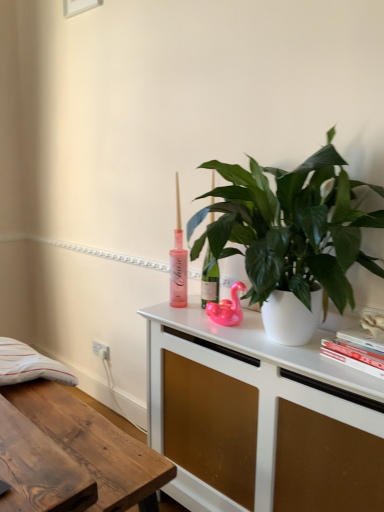
Question: Is wooden desk at lower left with pink rubber duck at center?

Choices:
 (A) yes
 (B) no

Answer: (B)

Question: Is wooden desk at lower left in front of pink rubber duck at center?

Choices:
 (A) yes
 (B) no

Answer: (A)

Question: Is wooden desk at lower left surrounding pink rubber duck at center?

Choices:
 (A) no
 (B) yes

Answer: (A)

Question: Is wooden desk at lower left oriented away from pink rubber duck at center?

Choices:
 (A) yes
 (B) no

Answer: (B)

Question: Considering the relative sizes of wooden desk at lower left and pink rubber duck at center in the image provided, is wooden desk at lower left shorter than pink rubber duck at center?

Choices:
 (A) no
 (B) yes

Answer: (A)

Question: Considering the relative positions of wooden desk at lower left and pink rubber duck at center in the image provided, is wooden desk at lower left to the left of pink rubber duck at center from the viewer's perspective?

Choices:
 (A) no
 (B) yes

Answer: (B)

Question: Would you say wooden desk at lower left is part of pink rubber duck at center's contents?

Choices:
 (A) no
 (B) yes

Answer: (A)

Question: From the image's perspective, is pink rubber duck at center beneath wooden desk at lower left?

Choices:
 (A) no
 (B) yes

Answer: (A)

Question: Is pink rubber duck at center to the right of wooden desk at lower left from the viewer's perspective?

Choices:
 (A) yes
 (B) no

Answer: (A)

Question: From a real-world perspective, is pink rubber duck at center below wooden desk at lower left?

Choices:
 (A) no
 (B) yes

Answer: (A)

Question: Can you confirm if pink rubber duck at center is taller than wooden desk at lower left?

Choices:
 (A) no
 (B) yes

Answer: (A)

Question: Is pink rubber duck at center located outside wooden desk at lower left?

Choices:
 (A) no
 (B) yes

Answer: (B)

Question: Is white plastic electric outlet at lower left thinner than wooden desk at lower left?

Choices:
 (A) yes
 (B) no

Answer: (A)